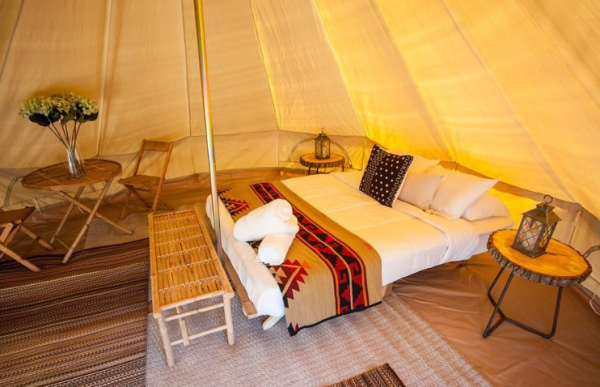
Identify the location of towels. The width and height of the screenshot is (600, 387). (285, 240), (267, 217).